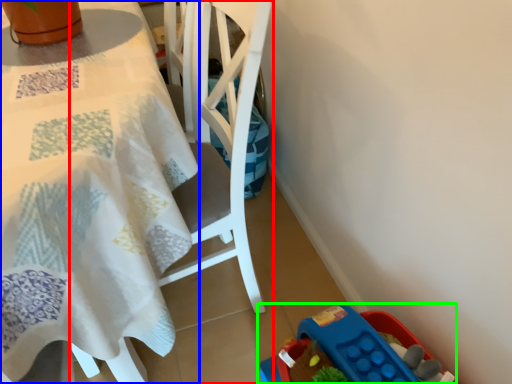
Question: Which is farther away from chair (highlighted by a red box)? table (highlighted by a blue box) or toy (highlighted by a green box)?

Choices:
 (A) table
 (B) toy

Answer: (B)